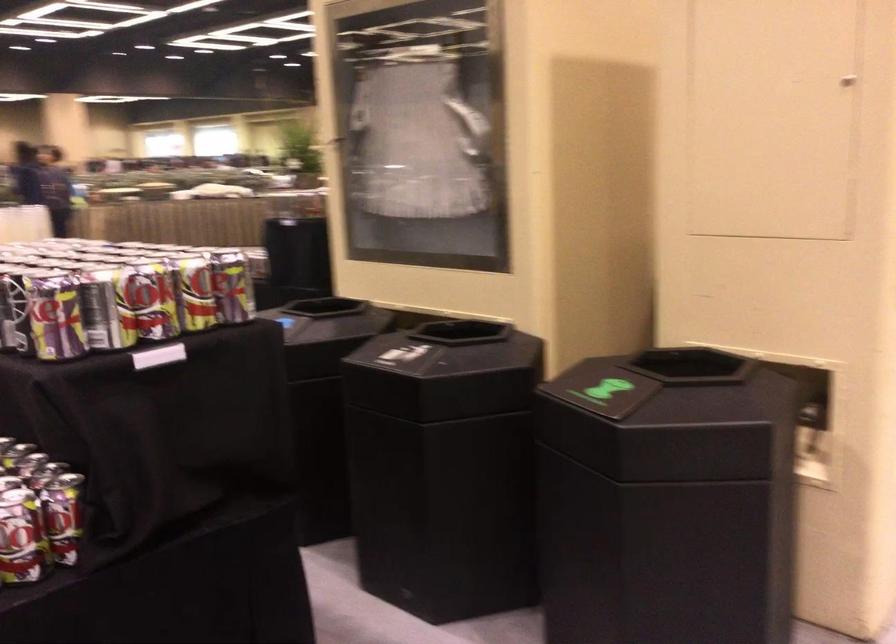
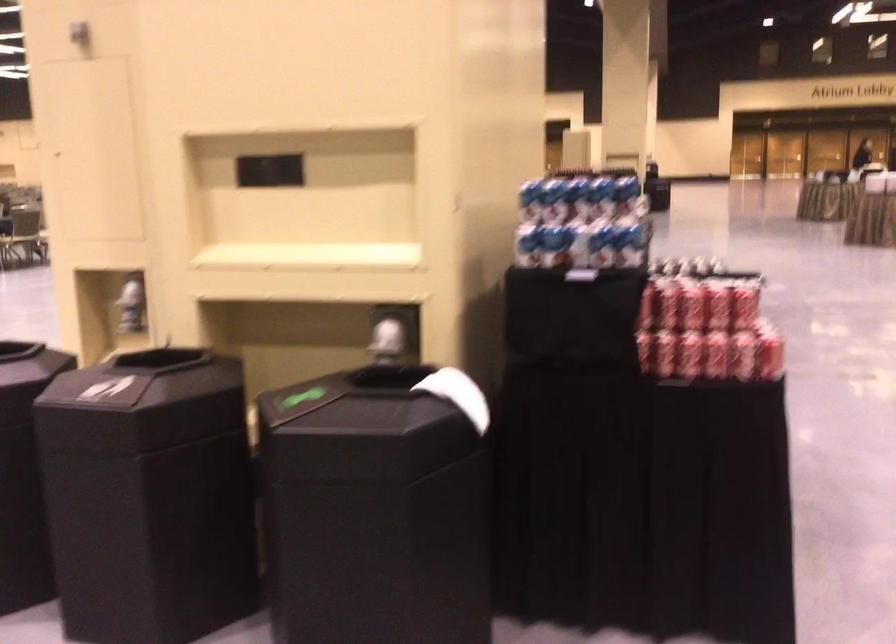
Question: I am providing you with two images of the same scene from different viewpoints. After the viewpoint changes to image2, which objects are now occluded?

Choices:
 (A) blue and white can
 (B) white piano keys
 (C) beverage can
 (D) white paper towel

Answer: (C)